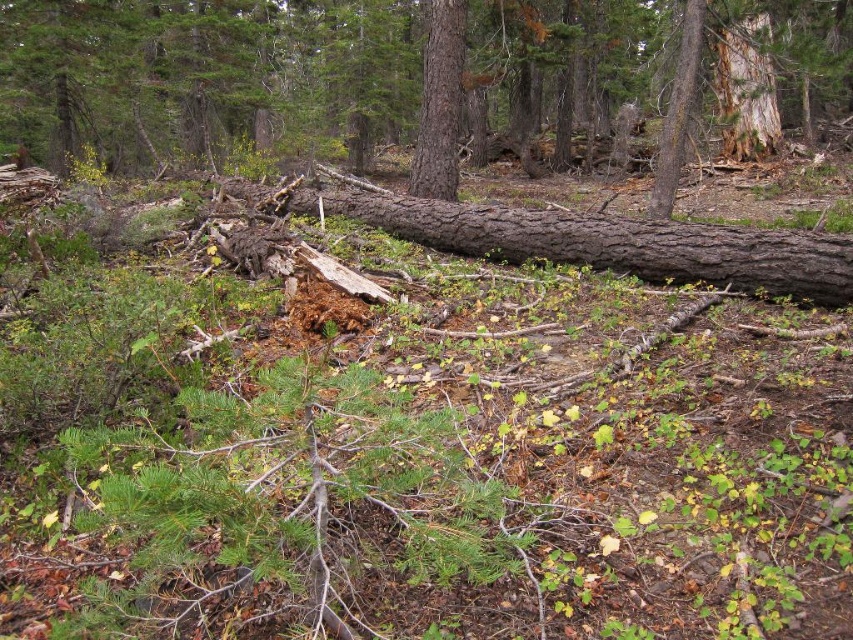
Question: Is brown rough log at center smaller than smooth brown tree trunk at center?

Choices:
 (A) yes
 (B) no

Answer: (B)

Question: Can you confirm if brown rough log at center is positioned below smooth brown tree trunk at center?

Choices:
 (A) no
 (B) yes

Answer: (A)

Question: Is brown rough log at center behind smooth brown tree trunk at center?

Choices:
 (A) no
 (B) yes

Answer: (A)